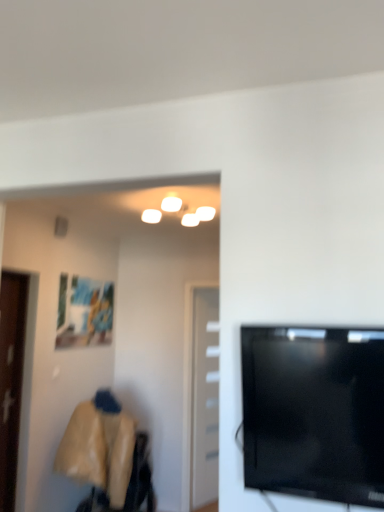
Find the location of a particular element. This screenshot has height=512, width=384. brown wooden door at left, the first door when ordered from front to back is located at coordinates (11, 379).

The width and height of the screenshot is (384, 512). I want to click on black glossy tv at right, so click(314, 413).

Is brown wooden door at left, the first door when ordered from front to back, further to the viewer compared to white glossy door at center, which is the 2th door in front-to-back order?

No, brown wooden door at left, the first door when ordered from front to back, is in front of white glossy door at center, which is the 2th door in front-to-back order.

Between brown wooden door at left, marked as the 2th door in a right-to-left arrangement, and white glossy door at center, which is counted as the first door, starting from the back, which one has larger size?

With larger size is white glossy door at center, which is counted as the first door, starting from the back.

Does brown wooden door at left, marked as the 2th door in a right-to-left arrangement, have a greater width compared to white glossy door at center, which is counted as the first door, starting from the back?

In fact, brown wooden door at left, marked as the 2th door in a right-to-left arrangement, might be narrower than white glossy door at center, which is counted as the first door, starting from the back.

Based on the photo, can you tell me how much brown wooden door at left, the first door when ordered from front to back, and white glossy door at center, which is counted as the first door, starting from the back, differ in facing direction?

The angle between the facing direction of brown wooden door at left, the first door when ordered from front to back, and the facing direction of white glossy door at center, which is counted as the first door, starting from the back, is 88.2 degrees.

From a real-world perspective, relative to brown wooden door at left, the first door when ordered from front to back, is black glossy tv at right vertically above or below?

Clearly, from a real-world perspective, black glossy tv at right is above brown wooden door at left, the first door when ordered from front to back.

Is point (266, 423) positioned in front of point (14, 400)?

Yes, point (266, 423) is in front of point (14, 400).

From the image's perspective, which one is positioned lower, black glossy tv at right or brown wooden door at left, which appears as the 1th door when viewed from the left?

brown wooden door at left, which appears as the 1th door when viewed from the left, appears lower in the image.

Measure the distance from black glossy tv at right to brown wooden door at left, marked as the 2th door in a right-to-left arrangement.

A distance of 2.46 meters exists between black glossy tv at right and brown wooden door at left, marked as the 2th door in a right-to-left arrangement.

Consider the image. How different are the orientations of brown wooden door at left, the first door when ordered from front to back, and matte plastic picture frame at upper left in degrees?

The facing directions of brown wooden door at left, the first door when ordered from front to back, and matte plastic picture frame at upper left are 1.04 degrees apart.

From the image's perspective, which one is positioned higher, brown wooden door at left, the first door when ordered from front to back, or matte plastic picture frame at upper left?

matte plastic picture frame at upper left, from the image's perspective.

Considering the relative positions of brown wooden door at left, the first door when ordered from front to back, and black glossy tv at right in the image provided, is brown wooden door at left, the first door when ordered from front to back, to the left of black glossy tv at right from the viewer's perspective?

Correct, you'll find brown wooden door at left, the first door when ordered from front to back, to the left of black glossy tv at right.

Considering the relative sizes of brown wooden door at left, which appears as the 1th door when viewed from the left, and black glossy tv at right in the image provided, is brown wooden door at left, which appears as the 1th door when viewed from the left, wider than black glossy tv at right?

Incorrect, the width of brown wooden door at left, which appears as the 1th door when viewed from the left, does not surpass that of black glossy tv at right.

Between brown wooden door at left, which appears as the 1th door when viewed from the left, and black glossy tv at right, which one has more height?

With more height is brown wooden door at left, which appears as the 1th door when viewed from the left.

Which point is more distant from viewer, [7,327] or [296,364]?

The point [7,327] is more distant.

Considering the relative positions of black glossy tv at right and matte plastic picture frame at upper left in the image provided, is black glossy tv at right in front of matte plastic picture frame at upper left?

Yes, it is in front of matte plastic picture frame at upper left.

Is black glossy tv at right spatially inside matte plastic picture frame at upper left, or outside of it?

black glossy tv at right is spatially situated outside matte plastic picture frame at upper left.

Is black glossy tv at right placed right next to matte plastic picture frame at upper left?

No, black glossy tv at right is not beside matte plastic picture frame at upper left.

From the image's perspective, is matte plastic picture frame at upper left under white glossy door at center, which is the 1th door from right to left?

Actually, matte plastic picture frame at upper left appears above white glossy door at center, which is the 1th door from right to left, in the image.

Does matte plastic picture frame at upper left have a greater width compared to white glossy door at center, arranged as the 2th door when viewed from the left?

No, matte plastic picture frame at upper left is not wider than white glossy door at center, arranged as the 2th door when viewed from the left.

The height and width of the screenshot is (512, 384). Identify the location of door located behind the matte plastic picture frame at upper left. (205, 397).

Is matte plastic picture frame at upper left oriented away from white glossy door at center, which is the 2th door in front-to-back order?

matte plastic picture frame at upper left does not have its back to white glossy door at center, which is the 2th door in front-to-back order.

Measure the distance from black glossy tv at right to white glossy door at center, which is the 2th door in front-to-back order.

A distance of 9.76 feet exists between black glossy tv at right and white glossy door at center, which is the 2th door in front-to-back order.

Can you confirm if black glossy tv at right is wider than white glossy door at center, which is the 2th door in front-to-back order?

Indeed, black glossy tv at right has a greater width compared to white glossy door at center, which is the 2th door in front-to-back order.

Is black glossy tv at right not within white glossy door at center, which is counted as the first door, starting from the back?

Yes.

From the image's perspective, which one is positioned higher, black glossy tv at right or white glossy door at center, which is the 1th door from right to left?

black glossy tv at right appears higher in the image.

At what (x,y) coordinates should I click in order to perform the action: click on door located in front of the white glossy door at center, arranged as the 2th door when viewed from the left. Please return your answer as a coordinate pair (x, y). Looking at the image, I should click on pos(11,379).

Which door is the 2nd one when counting from the left side of the black glossy tv at right? Please provide its 2D coordinates.

[(11, 379)]

Considering their positions, is matte plastic picture frame at upper left positioned further to white glossy door at center, which is the 1th door from right to left, than black glossy tv at right?

Among the two, black glossy tv at right is located further to white glossy door at center, which is the 1th door from right to left.

When comparing their distances from matte plastic picture frame at upper left, does white glossy door at center, which is the 1th door from right to left, or brown wooden door at left, which appears as the 1th door when viewed from the left, seem closer?

Based on the image, brown wooden door at left, which appears as the 1th door when viewed from the left, appears to be nearer to matte plastic picture frame at upper left.

Estimate the real-world distances between objects in this image. Which object is closer to matte plastic picture frame at upper left, brown wooden door at left, which appears as the 1th door when viewed from the left, or white glossy door at center, arranged as the 2th door when viewed from the left?

brown wooden door at left, which appears as the 1th door when viewed from the left, is positioned closer to the anchor matte plastic picture frame at upper left.

Based on their spatial positions, is matte plastic picture frame at upper left or white glossy door at center, which is counted as the first door, starting from the back, closer to brown wooden door at left, the first door when ordered from front to back?

The object closer to brown wooden door at left, the first door when ordered from front to back, is matte plastic picture frame at upper left.

When comparing their distances from brown wooden door at left, the first door when ordered from front to back, does black glossy tv at right or matte plastic picture frame at upper left seem closer?

The object closer to brown wooden door at left, the first door when ordered from front to back, is matte plastic picture frame at upper left.

Estimate the real-world distances between objects in this image. Which object is closer to black glossy tv at right, white glossy door at center, which is counted as the first door, starting from the back, or matte plastic picture frame at upper left?

matte plastic picture frame at upper left is closer to black glossy tv at right.

Based on their spatial positions, is white glossy door at center, which is counted as the first door, starting from the back, or black glossy tv at right further from matte plastic picture frame at upper left?

Among the two, black glossy tv at right is located further to matte plastic picture frame at upper left.

Considering their positions, is matte plastic picture frame at upper left positioned further to white glossy door at center, which is counted as the first door, starting from the back, than brown wooden door at left, positioned as the 2th door in back-to-front order?

brown wooden door at left, positioned as the 2th door in back-to-front order.

The width and height of the screenshot is (384, 512). Identify the location of door positioned between black glossy tv at right and matte plastic picture frame at upper left from near to far. point(11,379).

Identify the location of picture frame between black glossy tv at right and white glossy door at center, which is the 1th door from right to left, along the z-axis. (84, 312).

At what (x,y) coordinates should I click in order to perform the action: click on door located between black glossy tv at right and white glossy door at center, which is the 1th door from right to left, in the depth direction. Please return your answer as a coordinate pair (x, y). The height and width of the screenshot is (512, 384). Looking at the image, I should click on (11, 379).

Locate an element on the screen. picture frame situated between brown wooden door at left, the first door when ordered from front to back, and white glossy door at center, which is the 2th door in front-to-back order, from left to right is located at coordinates (84, 312).